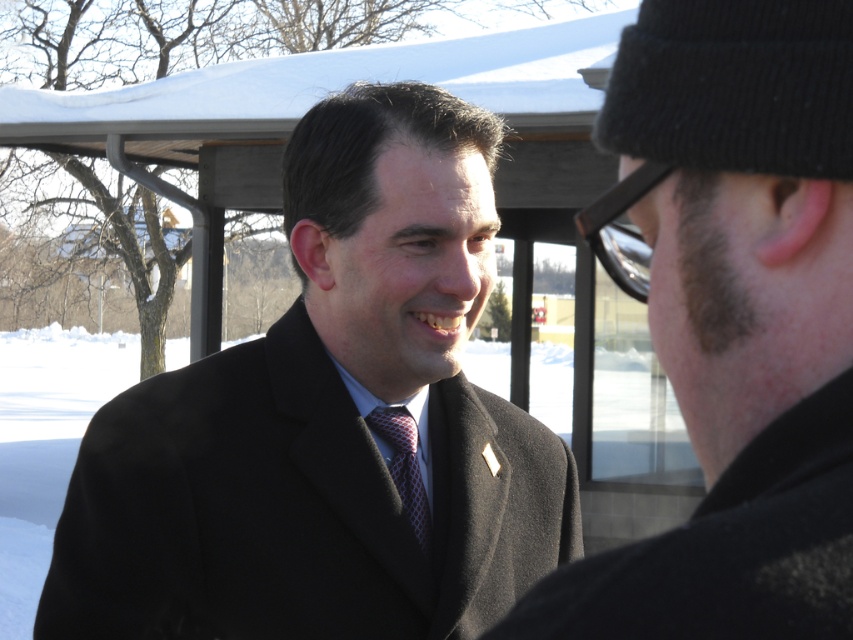
Question: Estimate the real-world distances between objects in this image. Which object is closer to the black wool coat at center?

Choices:
 (A) metallic reflective goggles at right
 (B) matte black coat at center
 (C) matte black suit at center
 (D) red checkered tie at center

Answer: (D)

Question: Is matte black coat at center smaller than metallic reflective goggles at right?

Choices:
 (A) no
 (B) yes

Answer: (B)

Question: Considering the relative positions of matte black suit at center and metallic reflective goggles at right in the image provided, where is matte black suit at center located with respect to metallic reflective goggles at right?

Choices:
 (A) above
 (B) below

Answer: (B)

Question: Where is matte black suit at center located in relation to red checkered tie at center in the image?

Choices:
 (A) below
 (B) above

Answer: (B)

Question: Among these objects, which one is farthest from the camera?

Choices:
 (A) metallic reflective goggles at right
 (B) matte black coat at center
 (C) matte black suit at center

Answer: (A)

Question: Based on their relative distances, which object is farther from the black wool coat at center?

Choices:
 (A) metallic reflective goggles at right
 (B) matte black coat at center

Answer: (B)